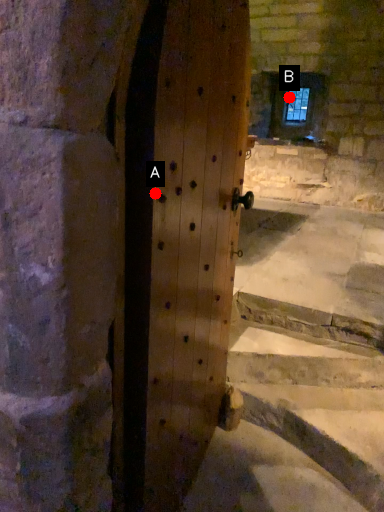
Question: Two points are circled on the image, labeled by A and B beside each circle. Which point is farther from the camera taking this photo?

Choices:
 (A) A is further
 (B) B is further

Answer: (B)